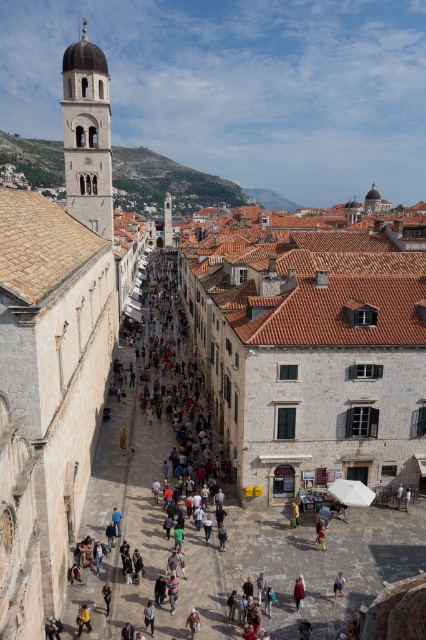
You are standing at the point marked by the coordinates point (298, 593) in the image. Looking around, you see a red wool coat at lower center. Which direction should you walk to reach the iconic bell tower visible on the left side of the image?

Since the iconic bell tower is visible on the left side of the image, and you are at point (298, 593) which is the red wool coat at lower center, you should walk towards the left to reach the bell tower.

Looking at this image, you are a photographer standing in the middle of the bustling street. You want to take a photo of the iconic bell tower on the left. However, there are two obstacles in your way. The light blue denim jeans at center and the dark gray fabric jacket at lower center are blocking your view. Which obstacle is bigger and would require you to move further to avoid?

The light blue denim jeans at center is larger in size than the dark gray fabric jacket at lower center, so you would need to move further to avoid the light blue denim jeans at center.